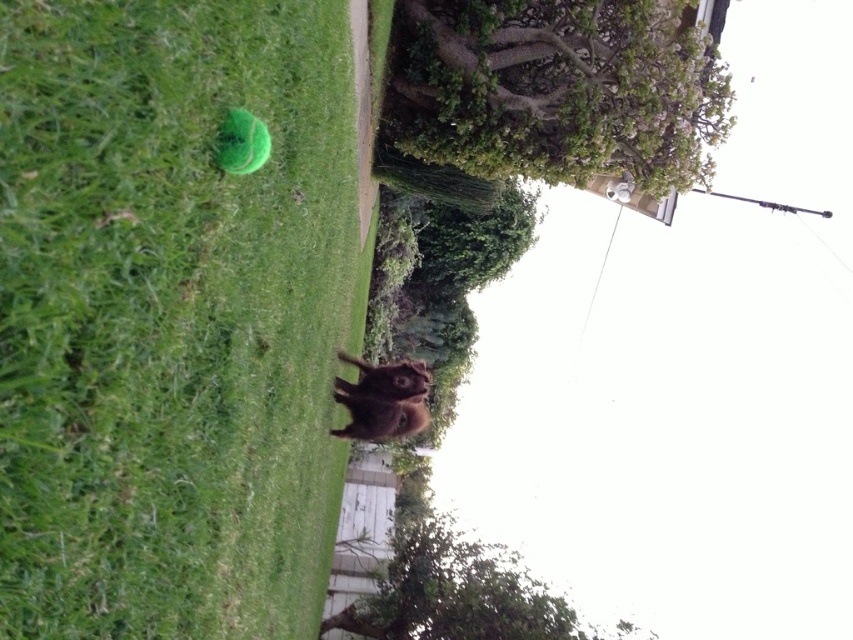
You are a photographer trying to capture a photo of the brown furry dog at center and the green leafy tree at upper center. Which object should you focus on first if you want to ensure both are in sharp focus?

The green leafy tree at upper center is much taller than the brown furry dog at center, so you should focus on the tree first to ensure both are in sharp focus.

You are a photographer trying to capture a clear shot of the brown furry dog at center. Since the green grass at lower left is in the way, can you determine if the grass is tall enough to block the dog from view?

The green grass at lower left is taller than brown furry dog at center, so it would block the dog from view.

You are planning to install a new fence between the green leafy tree at upper center and the green leafy tree at lower center. The fence needs to be 5 meters long to fit between them. Will the fence be long enough based on their distance?

The distance between the green leafy tree at upper center and the green leafy tree at lower center is 5.69 meters. Since the fence is only 5 meters long, it will not be long enough to span the distance between them.